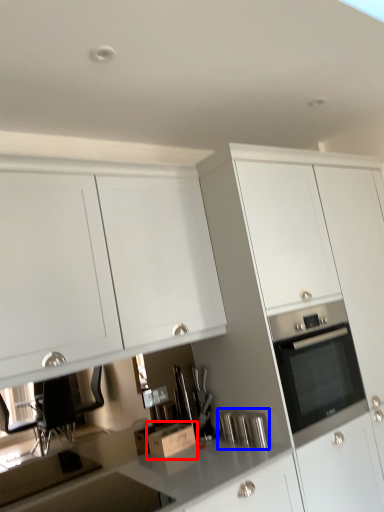
Question: Which object appears farthest to the camera in this image, cardboard box (highlighted by a red box) or appliance (highlighted by a blue box)?

Choices:
 (A) cardboard box
 (B) appliance

Answer: (A)